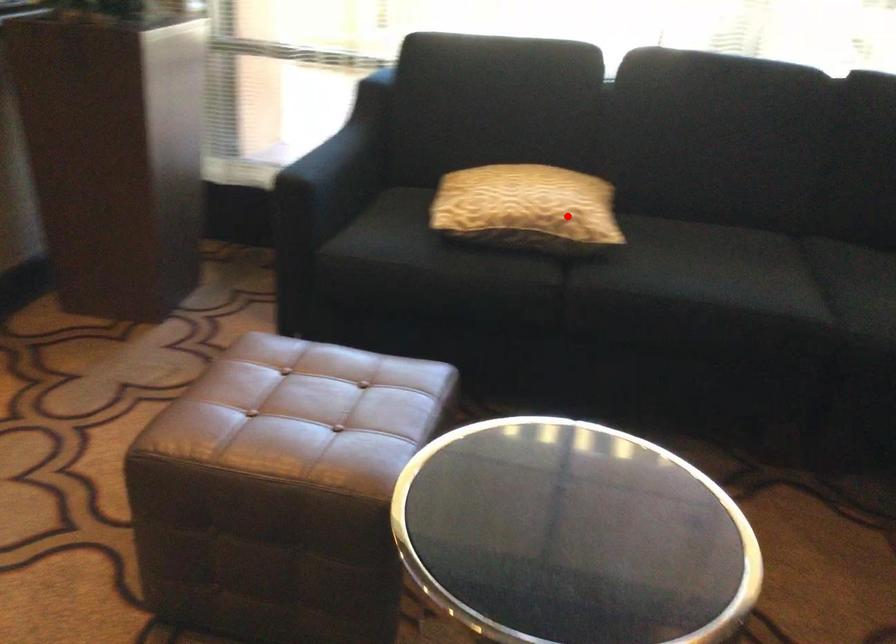
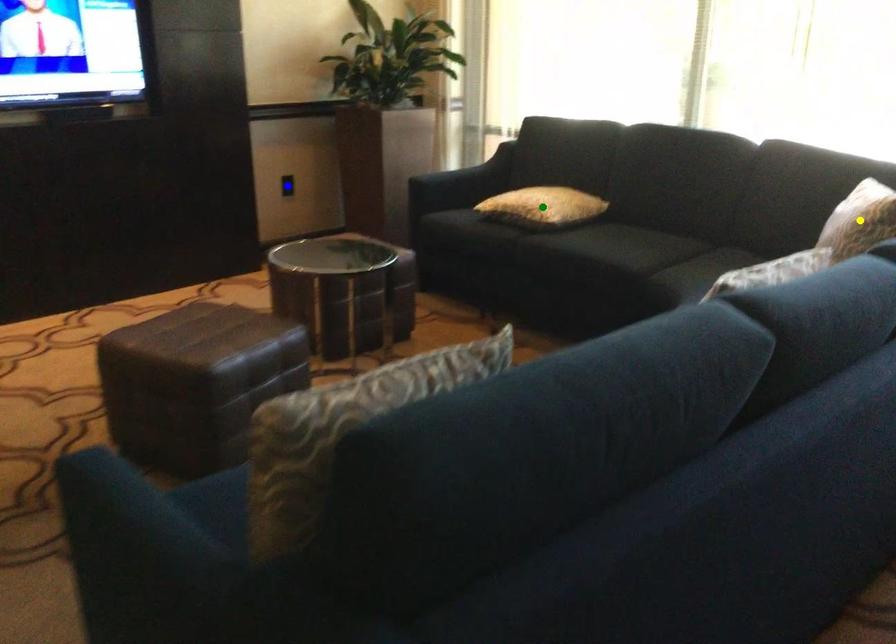
Question: I am providing you with two images of the same scene from different viewpoints. A red point is marked on the first image. You are given multiple points on the second image. Can you choose the point in image 2 that corresponds to the point in image 1?

Choices:
 (A) yellow point
 (B) green point
 (C) blue point

Answer: (B)